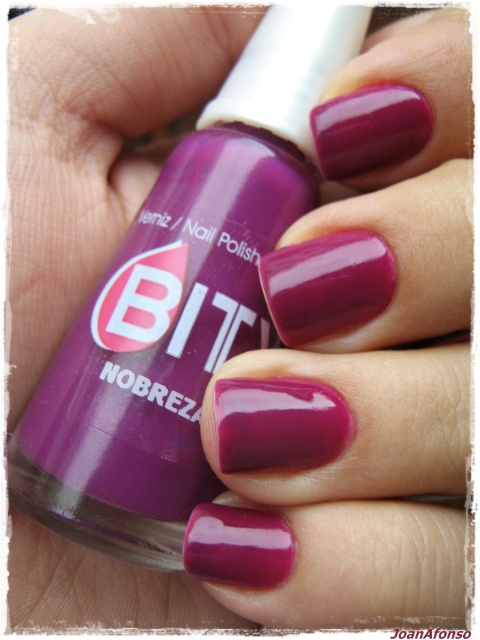
You are a nail technician who needs to apply the glossy nail polish at center to a client. The recommended distance for applying nail polish without making a mess is 18 inches. Can you apply the polish at the current distance?

The glossy nail polish at center is 18.31 inches away from the viewer. Since the recommended distance is 18 inches, the current distance is slightly farther than recommended, so you can still apply the polish but may need to adjust your hand slightly closer for precision.